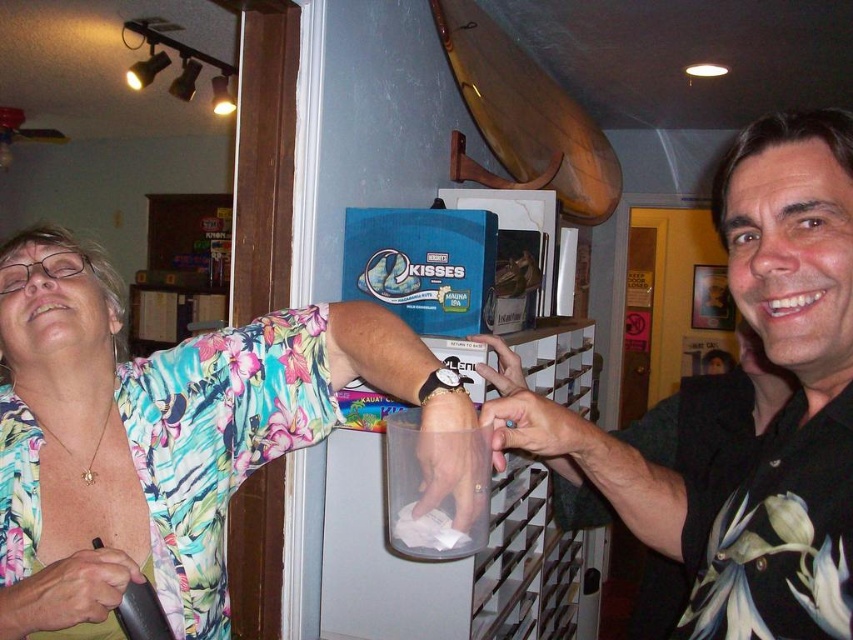
You are standing in the room and want to reach the point marked as point (177,492). If you take two steps forward, each step covering 1.5 feet, will you reach the point?

The distance between you and point (177,492) is 3.33 feet. Taking two steps of 1.5 feet each covers 3 feet. Since 3 feet is less than 3.33 feet, you won

What is the position of the floral fabric shirt at upper left relative to the point marked at coordinates (160, 435)?

The point marked at coordinates (160, 435) is exactly where the floral fabric shirt at upper left is located.